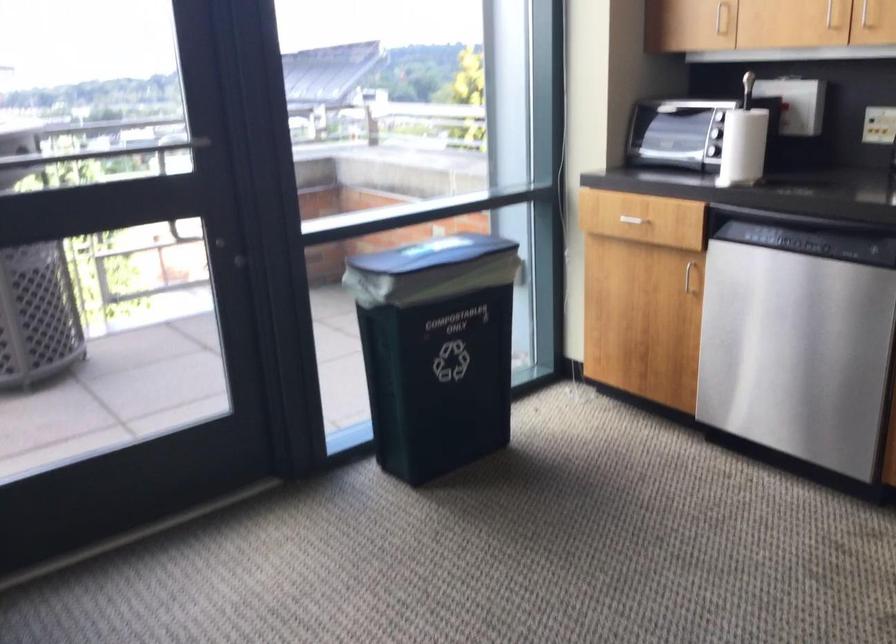
The width and height of the screenshot is (896, 644). Identify the location of silver drawer handle. [633, 214].